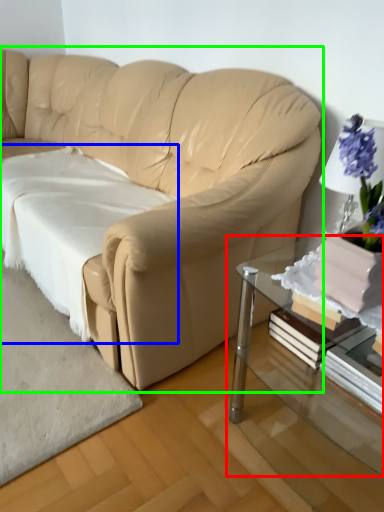
Question: Considering the real-world distances, which object is closest to table (highlighted by a red box)? sheet (highlighted by a blue box) or studio couch (highlighted by a green box).

Choices:
 (A) sheet
 (B) studio couch

Answer: (B)